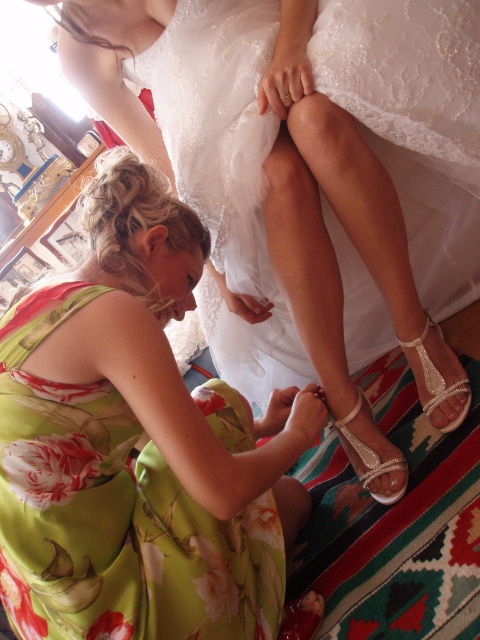
You are a photographer holding a camera. You want to take a photo of the white lace dress at center from a distance that allows you to capture the entire dress without zooming. Given that the camera has a maximum focus range of 4 feet, will you be able to take the photo clearly?

The white lace dress at center and camera are 3.94 feet apart, so yes, the photographer can take the photo clearly since the distance is within the camera maximum focus range of 4 feet.

You are a photographer at a wedding preparation. You need to position a light source to illuminate the white lace dress at center and the green floral dress at lower left. Based on their positions, which dress should be closer to the light source to ensure both are equally lit?

The white lace dress at center should be closer to the light source because it is located above the green floral dress at lower left, so positioning it nearer ensures equal illumination.